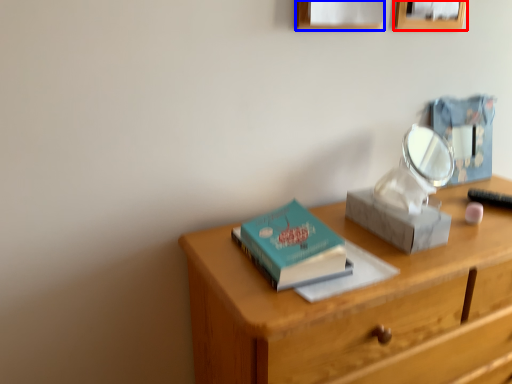
Question: Which object is further to the camera taking this photo, picture frame (highlighted by a red box) or picture frame (highlighted by a blue box)?

Choices:
 (A) picture frame
 (B) picture frame

Answer: (A)